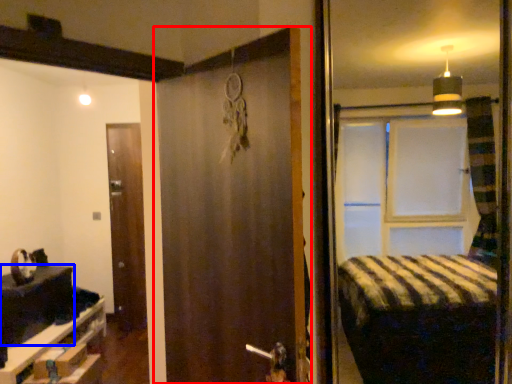
Question: Which of the following is the farthest to the observer, door (highlighted by a red box) or table (highlighted by a blue box)?

Choices:
 (A) door
 (B) table

Answer: (B)